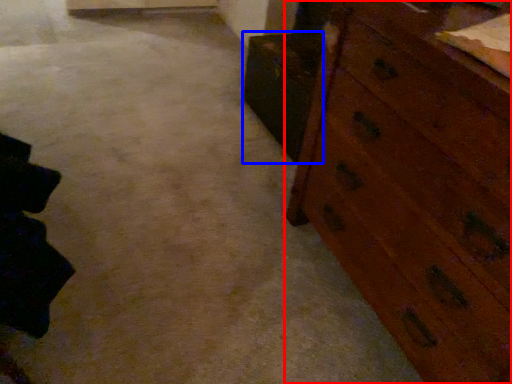
Question: Which point is closer to the camera, chest of drawers (highlighted by a red box) or cabinetry (highlighted by a blue box)?

Choices:
 (A) chest of drawers
 (B) cabinetry

Answer: (A)